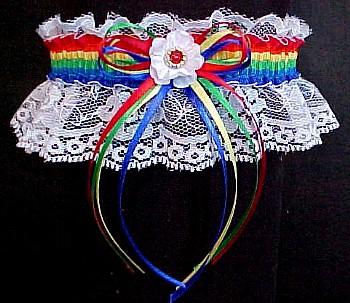
At what (x,y) coordinates should I click in order to perform the action: click on white lace. Please return your answer as a coordinate pair (x, y). The width and height of the screenshot is (350, 303). Looking at the image, I should click on (293, 109), (272, 26).